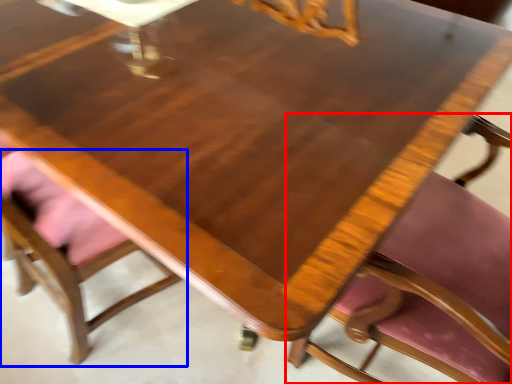
Question: Which object appears farthest to the camera in this image, chair (highlighted by a red box) or chair (highlighted by a blue box)?

Choices:
 (A) chair
 (B) chair

Answer: (B)